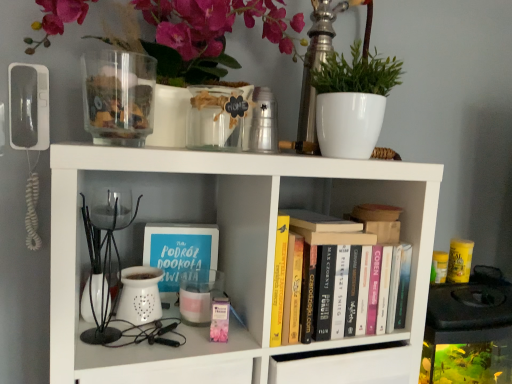
Question: Should I look upward or downward to see blue matte book at center-left?

Choices:
 (A) down
 (B) up

Answer: (A)

Question: Can you confirm if blue matte book at center-left is taller than transparent glass jar at upper left, positioned as the first glass vase in left-to-right order?

Choices:
 (A) no
 (B) yes

Answer: (B)

Question: Can you see blue matte book at center-left touching transparent glass jar at upper left, the second glass vase viewed from the right?

Choices:
 (A) no
 (B) yes

Answer: (A)

Question: Is blue matte book at center-left thinner than transparent glass jar at upper left, positioned as the first glass vase in left-to-right order?

Choices:
 (A) no
 (B) yes

Answer: (B)

Question: Is blue matte book at center-left looking in the opposite direction of transparent glass jar at upper left, positioned as the first glass vase in left-to-right order?

Choices:
 (A) no
 (B) yes

Answer: (A)

Question: Considering the relative sizes of blue matte book at center-left and transparent glass jar at upper left, the second glass vase viewed from the right, in the image provided, is blue matte book at center-left wider than transparent glass jar at upper left, the second glass vase viewed from the right,?

Choices:
 (A) yes
 (B) no

Answer: (B)

Question: Can we say blue matte book at center-left lies outside transparent glass jar at upper left, the second glass vase viewed from the right?

Choices:
 (A) yes
 (B) no

Answer: (A)

Question: Is transparent glass jar at upper left, positioned as the first glass vase in left-to-right order, at the back of white matte bookshelf at center?

Choices:
 (A) no
 (B) yes

Answer: (A)

Question: Is white matte bookshelf at center facing towards transparent glass jar at upper left, positioned as the first glass vase in left-to-right order?

Choices:
 (A) no
 (B) yes

Answer: (A)

Question: From the image's perspective, is white matte bookshelf at center under transparent glass jar at upper left, the second glass vase viewed from the right?

Choices:
 (A) yes
 (B) no

Answer: (A)

Question: Is white matte bookshelf at center directly adjacent to transparent glass jar at upper left, the second glass vase viewed from the right?

Choices:
 (A) yes
 (B) no

Answer: (B)

Question: Is white matte bookshelf at center wider than transparent glass jar at upper left, positioned as the first glass vase in left-to-right order?

Choices:
 (A) yes
 (B) no

Answer: (A)

Question: Is white matte bookshelf at center not inside transparent glass jar at upper left, positioned as the first glass vase in left-to-right order?

Choices:
 (A) no
 (B) yes

Answer: (B)

Question: Considering the relative positions of white matte bookshelf at center and white ceramic plant at upper right in the image provided, is white matte bookshelf at center in front of white ceramic plant at upper right?

Choices:
 (A) no
 (B) yes

Answer: (B)